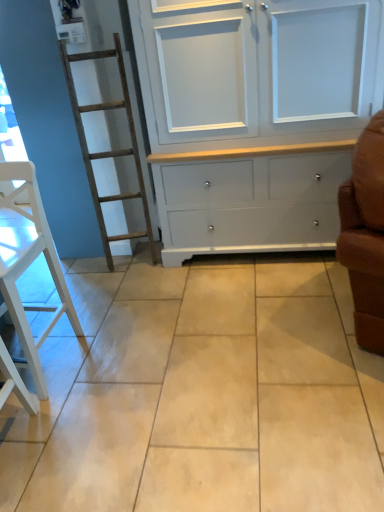
Question: Is the depth of beige ceramic tile at center greater than that of white painted wood cupboard at center?

Choices:
 (A) no
 (B) yes

Answer: (A)

Question: Is beige ceramic tile at center facing towards white painted wood cupboard at center?

Choices:
 (A) no
 (B) yes

Answer: (A)

Question: Would you say beige ceramic tile at center is a long distance from white painted wood cupboard at center?

Choices:
 (A) yes
 (B) no

Answer: (B)

Question: Is white painted wood cupboard at center at the back of beige ceramic tile at center?

Choices:
 (A) yes
 (B) no

Answer: (B)

Question: Is beige ceramic tile at center outside of white painted wood cupboard at center?

Choices:
 (A) yes
 (B) no

Answer: (A)

Question: Considering the relative sizes of beige ceramic tile at center and white painted wood cupboard at center in the image provided, is beige ceramic tile at center thinner than white painted wood cupboard at center?

Choices:
 (A) no
 (B) yes

Answer: (A)

Question: Considering the relative positions of white painted wood cupboard at center and white wood chair at left in the image provided, is white painted wood cupboard at center to the right of white wood chair at left from the viewer's perspective?

Choices:
 (A) yes
 (B) no

Answer: (A)

Question: Is white painted wood cupboard at center turned away from white wood chair at left?

Choices:
 (A) yes
 (B) no

Answer: (B)

Question: From a real-world perspective, does white painted wood cupboard at center stand above white wood chair at left?

Choices:
 (A) yes
 (B) no

Answer: (A)

Question: Would you say white painted wood cupboard at center contains white wood chair at left?

Choices:
 (A) no
 (B) yes

Answer: (A)

Question: From a real-world perspective, is white painted wood cupboard at center located beneath white wood chair at left?

Choices:
 (A) yes
 (B) no

Answer: (B)

Question: Is white painted wood cupboard at center wider than white wood chair at left?

Choices:
 (A) yes
 (B) no

Answer: (A)

Question: Considering the relative sizes of white painted wood cupboard at center and beige ceramic tile at center in the image provided, is white painted wood cupboard at center shorter than beige ceramic tile at center?

Choices:
 (A) no
 (B) yes

Answer: (A)